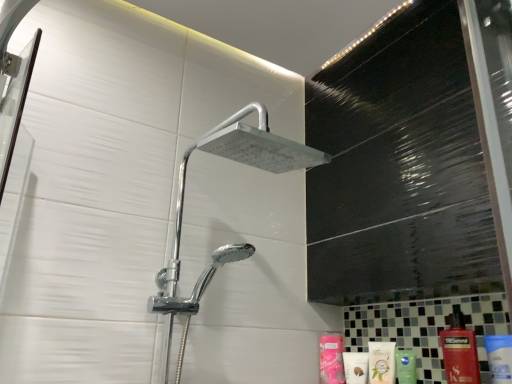
At what (x,y) coordinates should I click in order to perform the action: click on white matte lotion at lower right, the 1th toiletry when ordered from front to back. Please return your answer as a coordinate pair (x, y). This screenshot has height=384, width=512. Looking at the image, I should click on (356, 367).

What is the approximate height of white glossy mouthwash at lower right?

white glossy mouthwash at lower right is 16.56 centimeters tall.

In the scene shown: Measure the distance between point (x=369, y=362) and camera.

A distance of 3.55 feet exists between point (x=369, y=362) and camera.

Measure the distance between point (454, 350) and camera.

Point (454, 350) is 35.39 inches from camera.

Describe the element at coordinates (460, 351) in the screenshot. The height and width of the screenshot is (384, 512). I see `red glossy shampoo at lower right` at that location.

Identify the location of white matte lotion at lower right, placed as the second toiletry when sorted from back to front. Image resolution: width=512 pixels, height=384 pixels. (356, 367).

I want to click on mouthwash that appears on the right of white matte lotion at lower right, the 1th toiletry when ordered from front to back, so click(x=381, y=362).

Which point is more distant from viewer, (379, 343) or (347, 356)?

Positioned behind is point (347, 356).

Is white glossy mouthwash at lower right facing towards white matte lotion at lower right, placed as the second toiletry when sorted from back to front?

No, white glossy mouthwash at lower right does not turn towards white matte lotion at lower right, placed as the second toiletry when sorted from back to front.

Are red glossy shampoo at lower right and pink matte lotion at lower center, the second toiletry in the front-to-back sequence, making contact?

No, red glossy shampoo at lower right is not beside pink matte lotion at lower center, the second toiletry in the front-to-back sequence.

From the image's perspective, which is below, red glossy shampoo at lower right or pink matte lotion at lower center, the first toiletry in the back-to-front sequence?

pink matte lotion at lower center, the first toiletry in the back-to-front sequence.

Does point (440, 332) lie in front of point (332, 361)?

Yes, it is in front of point (332, 361).

Does red glossy shampoo at lower right have a smaller size compared to pink matte lotion at lower center, the first toiletry in the back-to-front sequence?

No, red glossy shampoo at lower right is not smaller than pink matte lotion at lower center, the first toiletry in the back-to-front sequence.

Is pink matte lotion at lower center, the first toiletry in the back-to-front sequence, aimed at red glossy shampoo at lower right?

No, pink matte lotion at lower center, the first toiletry in the back-to-front sequence, is not oriented towards red glossy shampoo at lower right.

Can you confirm if pink matte lotion at lower center, the second toiletry in the front-to-back sequence, is positioned to the left of red glossy shampoo at lower right?

Correct, you'll find pink matte lotion at lower center, the second toiletry in the front-to-back sequence, to the left of red glossy shampoo at lower right.

Can you confirm if pink matte lotion at lower center, the first toiletry in the back-to-front sequence, is thinner than red glossy shampoo at lower right?

Indeed, pink matte lotion at lower center, the first toiletry in the back-to-front sequence, has a lesser width compared to red glossy shampoo at lower right.

From a real-world perspective, is pink matte lotion at lower center, the first toiletry in the back-to-front sequence, on top of red glossy shampoo at lower right?

No, from a real-world perspective, pink matte lotion at lower center, the first toiletry in the back-to-front sequence, is not on top of red glossy shampoo at lower right.

Which is behind, point (327, 375) or point (347, 367)?

The point (327, 375) is behind.

Locate an element on the screen. The height and width of the screenshot is (384, 512). toiletry located below the white matte lotion at lower right, placed as the second toiletry when sorted from back to front (from the image's perspective) is located at coordinates (331, 359).

From the image's perspective, is pink matte lotion at lower center, the first toiletry in the back-to-front sequence, located beneath white matte lotion at lower right, placed as the second toiletry when sorted from back to front?

Correct, pink matte lotion at lower center, the first toiletry in the back-to-front sequence, appears lower than white matte lotion at lower right, placed as the second toiletry when sorted from back to front, in the image.

Which object is positioned more to the left, pink matte lotion at lower center, the first toiletry in the back-to-front sequence, or white matte lotion at lower right, the 1th toiletry when ordered from front to back?

pink matte lotion at lower center, the first toiletry in the back-to-front sequence, is more to the left.

Is pink matte lotion at lower center, the second toiletry in the front-to-back sequence, oriented away from white glossy mouthwash at lower right?

pink matte lotion at lower center, the second toiletry in the front-to-back sequence, does not have its back to white glossy mouthwash at lower right.

Can you confirm if pink matte lotion at lower center, the first toiletry in the back-to-front sequence, is wider than white glossy mouthwash at lower right?

In fact, pink matte lotion at lower center, the first toiletry in the back-to-front sequence, might be narrower than white glossy mouthwash at lower right.

From the white glossy mouthwash at lower right, count the 2nd toiletry to the left and point to it. Please provide its 2D coordinates.

[(331, 359)]

From a real-world perspective, between pink matte lotion at lower center, the first toiletry in the back-to-front sequence, and white glossy mouthwash at lower right, who is vertically higher?

In real-world perspective, pink matte lotion at lower center, the first toiletry in the back-to-front sequence, is above.

Can you confirm if white matte lotion at lower right, the 1th toiletry when ordered from front to back, is bigger than white glossy mouthwash at lower right?

No.

Which is behind, white matte lotion at lower right, placed as the second toiletry when sorted from back to front, or white glossy mouthwash at lower right?

white matte lotion at lower right, placed as the second toiletry when sorted from back to front, is further away from the camera.

Is white matte lotion at lower right, the 1th toiletry when ordered from front to back, located outside white glossy mouthwash at lower right?

Yes, white matte lotion at lower right, the 1th toiletry when ordered from front to back, is not within white glossy mouthwash at lower right.

Locate an element on the screen. The width and height of the screenshot is (512, 384). mouthwash to the right of white matte lotion at lower right, placed as the second toiletry when sorted from back to front is located at coordinates (381, 362).

Does white glossy mouthwash at lower right contain pink matte lotion at lower center, the second toiletry in the front-to-back sequence?

That's incorrect, pink matte lotion at lower center, the second toiletry in the front-to-back sequence, is not inside white glossy mouthwash at lower right.

Who is taller, white glossy mouthwash at lower right or pink matte lotion at lower center, the first toiletry in the back-to-front sequence?

pink matte lotion at lower center, the first toiletry in the back-to-front sequence.

Consider the image. Is pink matte lotion at lower center, the second toiletry in the front-to-back sequence, at the back of white glossy mouthwash at lower right?

No, white glossy mouthwash at lower right is not facing away from pink matte lotion at lower center, the second toiletry in the front-to-back sequence.

Where is `the 1st toiletry positioned below the white glossy mouthwash at lower right (from the image's perspective)`? Image resolution: width=512 pixels, height=384 pixels. the 1st toiletry positioned below the white glossy mouthwash at lower right (from the image's perspective) is located at coordinates (356, 367).

Which toiletry is the 2nd one when counting from the back of the red glossy shampoo at lower right? Please provide its 2D coordinates.

[(331, 359)]

Estimate the real-world distances between objects in this image. Which object is further from white glossy mouthwash at lower right, pink matte lotion at lower center, the first toiletry in the back-to-front sequence, or white matte lotion at lower right, placed as the second toiletry when sorted from back to front?

pink matte lotion at lower center, the first toiletry in the back-to-front sequence, lies further to white glossy mouthwash at lower right than the other object.

Considering their positions, is white matte lotion at lower right, the 1th toiletry when ordered from front to back, positioned further to white glossy mouthwash at lower right than red glossy shampoo at lower right?

Among the two, red glossy shampoo at lower right is located further to white glossy mouthwash at lower right.

Considering their positions, is red glossy shampoo at lower right positioned closer to pink matte lotion at lower center, the first toiletry in the back-to-front sequence, than white matte lotion at lower right, placed as the second toiletry when sorted from back to front?

white matte lotion at lower right, placed as the second toiletry when sorted from back to front, is positioned closer to the anchor pink matte lotion at lower center, the first toiletry in the back-to-front sequence.

Looking at the image, which one is located closer to white matte lotion at lower right, placed as the second toiletry when sorted from back to front, white glossy mouthwash at lower right or red glossy shampoo at lower right?

→ Based on the image, white glossy mouthwash at lower right appears to be nearer to white matte lotion at lower right, placed as the second toiletry when sorted from back to front.

Which object lies further to the anchor point white glossy mouthwash at lower right, pink matte lotion at lower center, the second toiletry in the front-to-back sequence, or red glossy shampoo at lower right?

red glossy shampoo at lower right.

Estimate the real-world distances between objects in this image. Which object is further from white matte lotion at lower right, the 1th toiletry when ordered from front to back, red glossy shampoo at lower right or pink matte lotion at lower center, the second toiletry in the front-to-back sequence?

red glossy shampoo at lower right lies further to white matte lotion at lower right, the 1th toiletry when ordered from front to back, than the other object.

When comparing their distances from white matte lotion at lower right, placed as the second toiletry when sorted from back to front, does red glossy shampoo at lower right or white glossy mouthwash at lower right seem closer?

The object closer to white matte lotion at lower right, placed as the second toiletry when sorted from back to front, is white glossy mouthwash at lower right.

When comparing their distances from red glossy shampoo at lower right, does pink matte lotion at lower center, the first toiletry in the back-to-front sequence, or white matte lotion at lower right, placed as the second toiletry when sorted from back to front, seem closer?

white matte lotion at lower right, placed as the second toiletry when sorted from back to front, is positioned closer to the anchor red glossy shampoo at lower right.

Image resolution: width=512 pixels, height=384 pixels. I want to click on mouthwash between red glossy shampoo at lower right and pink matte lotion at lower center, the first toiletry in the back-to-front sequence, in the front-back direction, so click(x=381, y=362).

Image resolution: width=512 pixels, height=384 pixels. In order to click on toiletry between white glossy mouthwash at lower right and pink matte lotion at lower center, the first toiletry in the back-to-front sequence, from front to back in this screenshot , I will do `click(356, 367)`.

Where is `toiletry between red glossy shampoo at lower right and pink matte lotion at lower center, the second toiletry in the front-to-back sequence, in the front-back direction`? This screenshot has height=384, width=512. toiletry between red glossy shampoo at lower right and pink matte lotion at lower center, the second toiletry in the front-to-back sequence, in the front-back direction is located at coordinates (356, 367).

You are a GUI agent. You are given a task and a screenshot of the screen. Output one action in this format:
    pyautogui.click(x=<x>, y=<y>)
    Task: Click on the mouthwash positioned between red glossy shampoo at lower right and white matte lotion at lower right, placed as the second toiletry when sorted from back to front, from near to far
    
    Given the screenshot: What is the action you would take?
    pyautogui.click(x=381, y=362)